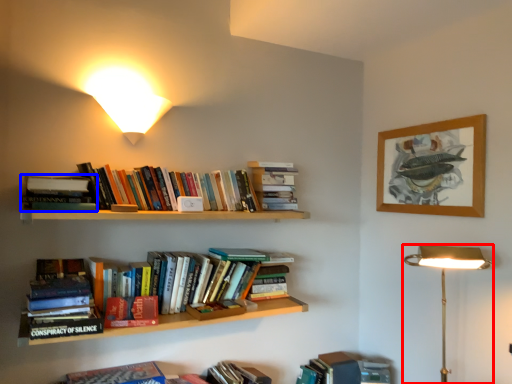
Question: Among these objects, which one is farthest to the camera, lamp (highlighted by a red box) or book (highlighted by a blue box)?

Choices:
 (A) lamp
 (B) book

Answer: (B)